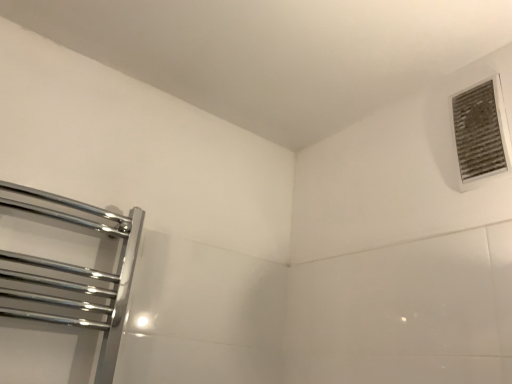
Question: Is chrome/metallic towel rack at left shorter than white textured vent at upper right?

Choices:
 (A) no
 (B) yes

Answer: (A)

Question: Is chrome/metallic towel rack at left oriented towards white textured vent at upper right?

Choices:
 (A) no
 (B) yes

Answer: (A)

Question: Is white textured vent at upper right located within chrome/metallic towel rack at left?

Choices:
 (A) no
 (B) yes

Answer: (A)

Question: From a real-world perspective, is chrome/metallic towel rack at left positioned under white textured vent at upper right based on gravity?

Choices:
 (A) yes
 (B) no

Answer: (A)

Question: Does chrome/metallic towel rack at left have a lesser width compared to white textured vent at upper right?

Choices:
 (A) no
 (B) yes

Answer: (A)

Question: Is chrome/metallic towel rack at left at the right side of white textured vent at upper right?

Choices:
 (A) yes
 (B) no

Answer: (B)

Question: Can you confirm if white textured vent at upper right is smaller than chrome/metallic towel rack at left?

Choices:
 (A) yes
 (B) no

Answer: (A)

Question: Is white textured vent at upper right far from chrome/metallic towel rack at left?

Choices:
 (A) yes
 (B) no

Answer: (A)

Question: Can you confirm if white textured vent at upper right is shorter than chrome/metallic towel rack at left?

Choices:
 (A) no
 (B) yes

Answer: (B)

Question: Is white textured vent at upper right positioned behind chrome/metallic towel rack at left?

Choices:
 (A) no
 (B) yes

Answer: (B)

Question: Considering the relative sizes of white textured vent at upper right and chrome/metallic towel rack at left in the image provided, is white textured vent at upper right bigger than chrome/metallic towel rack at left?

Choices:
 (A) yes
 (B) no

Answer: (B)

Question: Does white textured vent at upper right appear on the right side of chrome/metallic towel rack at left?

Choices:
 (A) no
 (B) yes

Answer: (B)

Question: Does point (3, 261) appear closer or farther from the camera than point (471, 99)?

Choices:
 (A) farther
 (B) closer

Answer: (B)